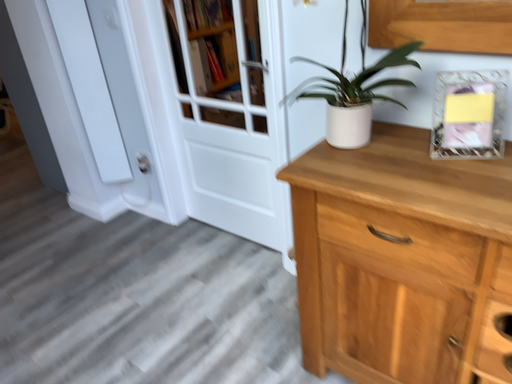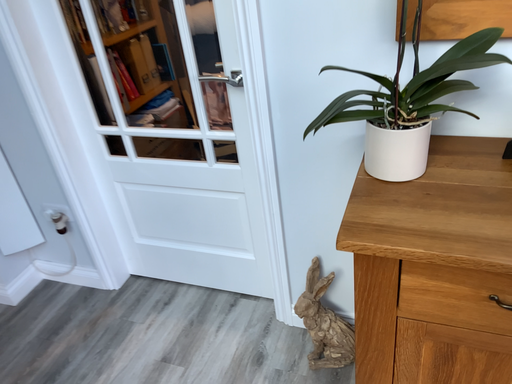
Question: How did the camera likely rotate when shooting the video?

Choices:
 (A) rotated left
 (B) rotated right

Answer: (B)